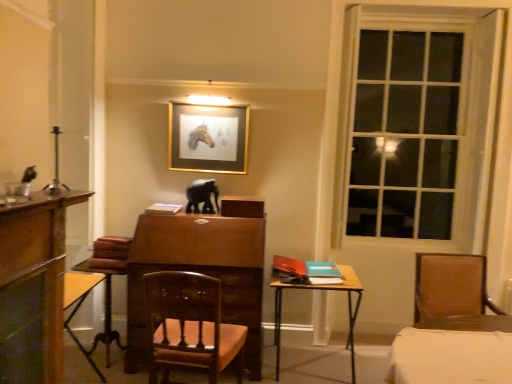
Question: From a real-world perspective, does wooden table at lower left, the second table when ordered from right to left, stand above black glossy elephant at center?

Choices:
 (A) yes
 (B) no

Answer: (B)

Question: Does wooden table at lower left, the 1th table in the left-to-right sequence, have a larger size compared to black glossy elephant at center?

Choices:
 (A) yes
 (B) no

Answer: (A)

Question: Does wooden table at lower left, the 1th table in the left-to-right sequence, have a smaller size compared to black glossy elephant at center?

Choices:
 (A) yes
 (B) no

Answer: (B)

Question: From the image's perspective, is wooden table at lower left, the second table when ordered from right to left, over black glossy elephant at center?

Choices:
 (A) yes
 (B) no

Answer: (B)

Question: Considering the relative positions of wooden table at lower left, the 1th table in the left-to-right sequence, and black glossy elephant at center in the image provided, is wooden table at lower left, the 1th table in the left-to-right sequence, to the left of black glossy elephant at center from the viewer's perspective?

Choices:
 (A) no
 (B) yes

Answer: (B)

Question: Is gold metallic picture frame at upper center inside or outside of wooden table at lower left, the second table when ordered from right to left?

Choices:
 (A) inside
 (B) outside

Answer: (B)

Question: Is point (196, 148) closer or farther from the camera than point (89, 268)?

Choices:
 (A) farther
 (B) closer

Answer: (A)

Question: In terms of width, does gold metallic picture frame at upper center look wider or thinner when compared to wooden table at lower left, the second table when ordered from right to left?

Choices:
 (A) wide
 (B) thin

Answer: (B)

Question: Considering the positions of gold metallic picture frame at upper center and wooden table at lower left, the second table when ordered from right to left, in the image, is gold metallic picture frame at upper center taller or shorter than wooden table at lower left, the second table when ordered from right to left,?

Choices:
 (A) tall
 (B) short

Answer: (B)

Question: From a real-world perspective, relative to wooden polished chair at center, the first chair positioned from the left, is white matte book at center vertically above or below?

Choices:
 (A) below
 (B) above

Answer: (B)

Question: Is point (173, 206) positioned closer to the camera than point (202, 314)?

Choices:
 (A) closer
 (B) farther

Answer: (B)

Question: Is white matte book at center taller or shorter than wooden polished chair at center, the 2th chair from the right?

Choices:
 (A) tall
 (B) short

Answer: (B)

Question: Which is correct: white matte book at center is inside wooden polished chair at center, the 2th chair from the right, or outside of it?

Choices:
 (A) outside
 (B) inside

Answer: (A)

Question: From the image's perspective, is wooden table at lower left, the second table when ordered from right to left, above or below white matte book at center?

Choices:
 (A) below
 (B) above

Answer: (A)

Question: In terms of width, does wooden table at lower left, the second table when ordered from right to left, look wider or thinner when compared to white matte book at center?

Choices:
 (A) wide
 (B) thin

Answer: (A)